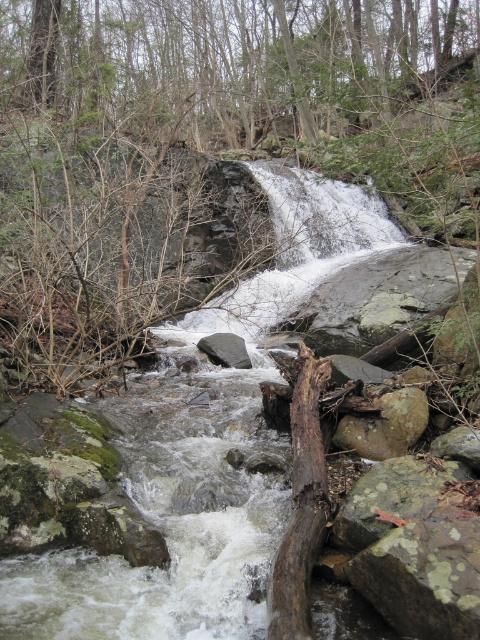
You are a hiker trying to cross the stream in the image. You see a brown rough log at center and a brown rough rock at center. Which object should you step on first to reach the other side?

You should step on the brown rough log at center first because it is in front of the brown rough rock at center, making it closer to your starting position.

You are an environmental scientist assessing the scene. You need to determine the elevation relationship between the green leafy tree at upper center and the brown rough rock at center. Which one is higher in elevation?

The green leafy tree at upper center is above the brown rough rock at center, so it is higher in elevation.

You are standing at the edge of the stream and want to cross to the other side. You see a brown rough log at center and a brown rough rock at center. Which object should you step on first to cross the stream?

You should step on the brown rough log at center first because it is positioned to the left of the brown rough rock at center, making it closer to your starting point on the edge of the stream.